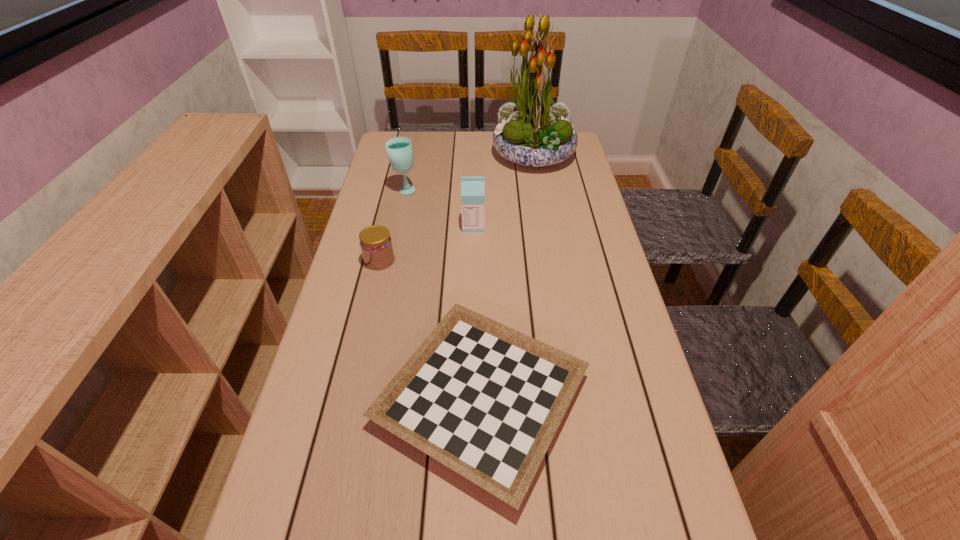
Identify the location of flower arrangement. (532, 131).

Where is `glass`? glass is located at coordinates (399, 149).

This screenshot has height=540, width=960. In order to click on milk carton in this screenshot , I will do `click(472, 188)`.

The height and width of the screenshot is (540, 960). What are the coordinates of `the fourth tallest object` in the screenshot? It's located at (376, 245).

Where is `jam`? The height and width of the screenshot is (540, 960). jam is located at coordinates (376, 245).

I want to click on checkerboard, so click(x=485, y=400).

Where is `the nearest object`? The width and height of the screenshot is (960, 540). the nearest object is located at coordinates (485, 400).

You are a GUI agent. You are given a task and a screenshot of the screen. Output one action in this format:
    pyautogui.click(x=<x>, y=<y>)
    Task: Click on the free space located 0.270m on the front-facing side of the tallest object
    The image size is (960, 540).
    Given the screenshot: What is the action you would take?
    pyautogui.click(x=419, y=156)

The height and width of the screenshot is (540, 960). I want to click on vacant space located 0.090m on the front-facing side of the tallest object, so click(x=468, y=156).

This screenshot has width=960, height=540. In order to click on free space located 0.210m on the front-facing side of the tallest object in this screenshot , I will do `click(435, 156)`.